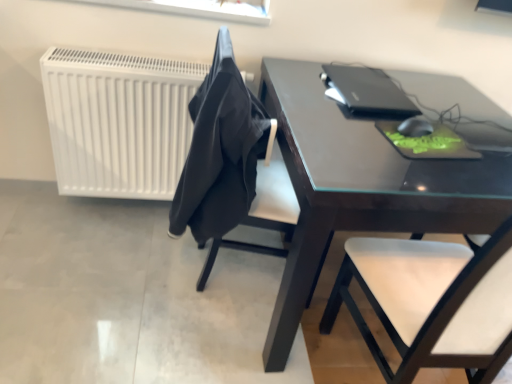
I want to click on vacant space in front of black matte mouse at upper right, so point(428,162).